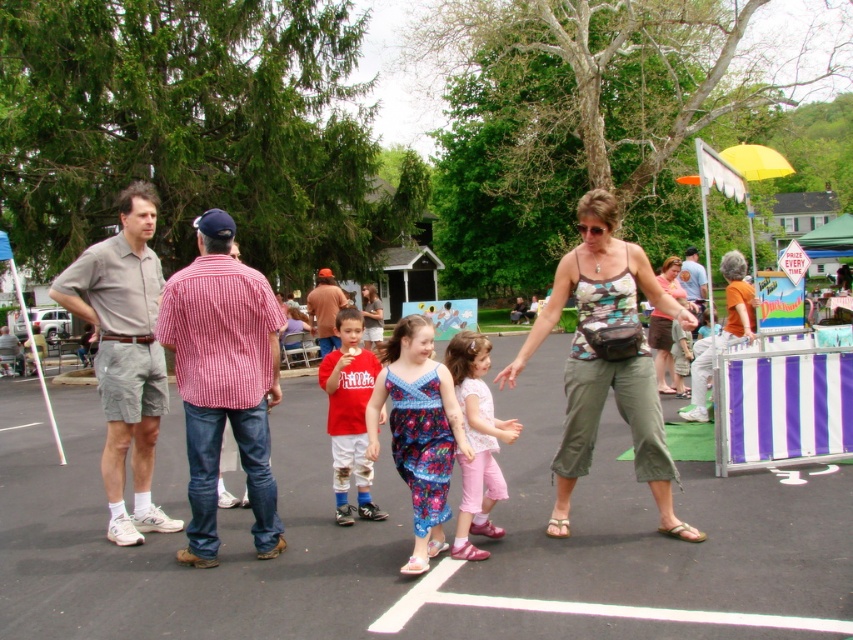
Is camouflage tank top at center positioned behind floral fabric dress at center?

That is True.

Can you confirm if camouflage tank top at center is positioned to the left of floral fabric dress at center?

Incorrect, camouflage tank top at center is not on the left side of floral fabric dress at center.

You are a GUI agent. You are given a task and a screenshot of the screen. Output one action in this format:
    pyautogui.click(x=<x>, y=<y>)
    Task: Click on the camouflage tank top at center
    The image size is (853, 640).
    Given the screenshot: What is the action you would take?
    pyautogui.click(x=607, y=358)

Which of these two, gray cotton shirt at left or floral fabric dress at center, stands shorter?

gray cotton shirt at left

I want to click on gray cotton shirt at left, so click(125, 355).

At what (x,y) coordinates should I click in order to perform the action: click on gray cotton shirt at left. Please return your answer as a coordinate pair (x, y). Looking at the image, I should click on (125, 355).

Who is shorter, camouflage tank top at center or pink fabric dress at center?

camouflage tank top at center is shorter.

Between point (641, 408) and point (517, 426), which one is positioned in front?

Point (517, 426) is in front.

Which is in front, point (569, 477) or point (480, 476)?

Positioned in front is point (480, 476).

This screenshot has width=853, height=640. Find the location of `camouflage tank top at center`. camouflage tank top at center is located at coordinates (607, 358).